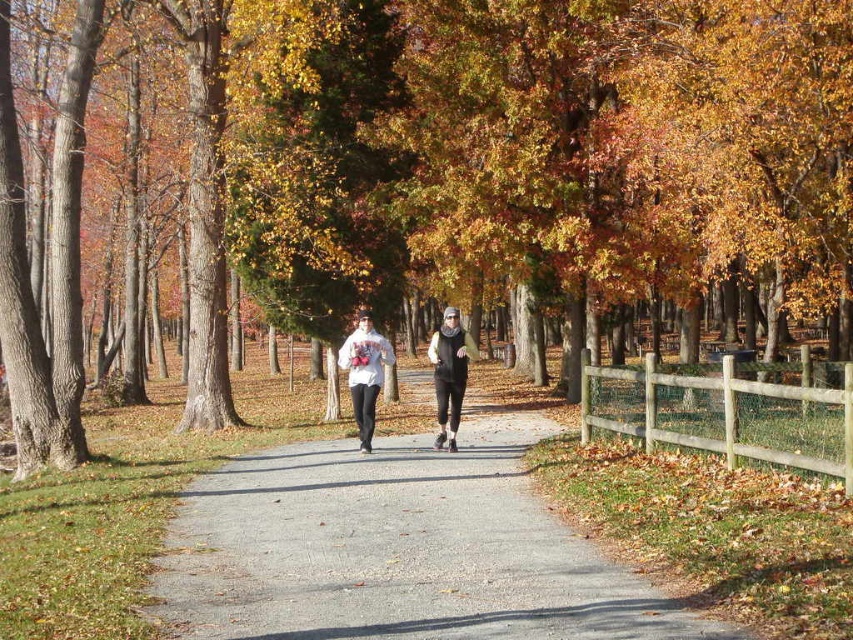
Is brown wood fence at center shorter than white fleece hoodie at center?

Incorrect, brown wood fence at center's height does not fall short of white fleece hoodie at center's.

Is brown wood fence at center to the right of white fleece hoodie at center from the viewer's perspective?

Incorrect, brown wood fence at center is not on the right side of white fleece hoodie at center.

Is point (785, 157) in front of point (459, 392)?

No, (785, 157) is behind (459, 392).

Locate an element on the screen. The image size is (853, 640). brown wood fence at center is located at coordinates (512, 152).

Can you confirm if brown wood fence at center is wider than white matte sweatshirt at center?

Correct, the width of brown wood fence at center exceeds that of white matte sweatshirt at center.

Is point (670, 179) positioned in front of point (370, 392)?

No, (670, 179) is further to viewer.

Does point (450, 172) come in front of point (357, 353)?

No, (450, 172) is behind (357, 353).

The height and width of the screenshot is (640, 853). Find the location of `brown wood fence at center`. brown wood fence at center is located at coordinates (512, 152).

Does brown wood fence at center have a lesser height compared to black matte jacket at center?

Incorrect, brown wood fence at center's height does not fall short of black matte jacket at center's.

Based on the photo, can you confirm if brown wood fence at center is wider than black matte jacket at center?

Yes.

Between point (589, 99) and point (451, 371), which one is positioned in front?

Positioned in front is point (451, 371).

The width and height of the screenshot is (853, 640). I want to click on brown wood fence at center, so click(x=512, y=152).